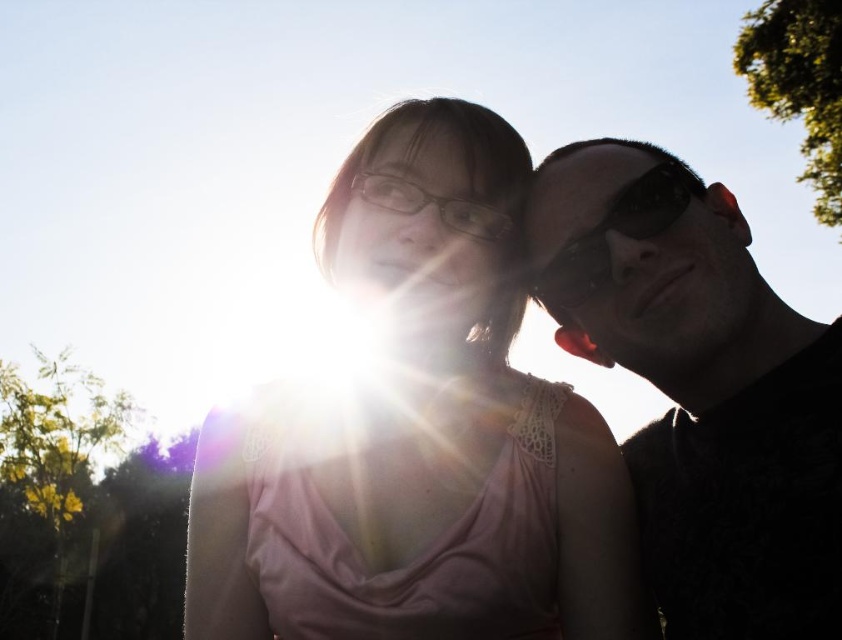
Between black matte sunglasses at right and black reflective sunglasses at right, which one has less height?

black reflective sunglasses at right

Which is in front, point (784, 400) or point (629, 234)?

Point (784, 400) is more forward.

Which is behind, point (830, 376) or point (594, 253)?

Positioned behind is point (594, 253).

Locate an element on the screen. The height and width of the screenshot is (640, 842). black matte sunglasses at right is located at coordinates (702, 392).

Who is taller, pink lace tank top at center or black matte sunglasses at right?

Standing taller between the two is pink lace tank top at center.

Does pink lace tank top at center have a smaller size compared to black matte sunglasses at right?

Actually, pink lace tank top at center might be larger than black matte sunglasses at right.

The image size is (842, 640). Describe the element at coordinates (419, 435) in the screenshot. I see `pink lace tank top at center` at that location.

The image size is (842, 640). I want to click on pink lace tank top at center, so click(x=419, y=435).

Does pink lace tank top at center appear on the left side of black reflective sunglasses at right?

Yes, pink lace tank top at center is to the left of black reflective sunglasses at right.

What do you see at coordinates (419, 435) in the screenshot? I see `pink lace tank top at center` at bounding box center [419, 435].

Where is `pink lace tank top at center`? This screenshot has height=640, width=842. pink lace tank top at center is located at coordinates (419, 435).